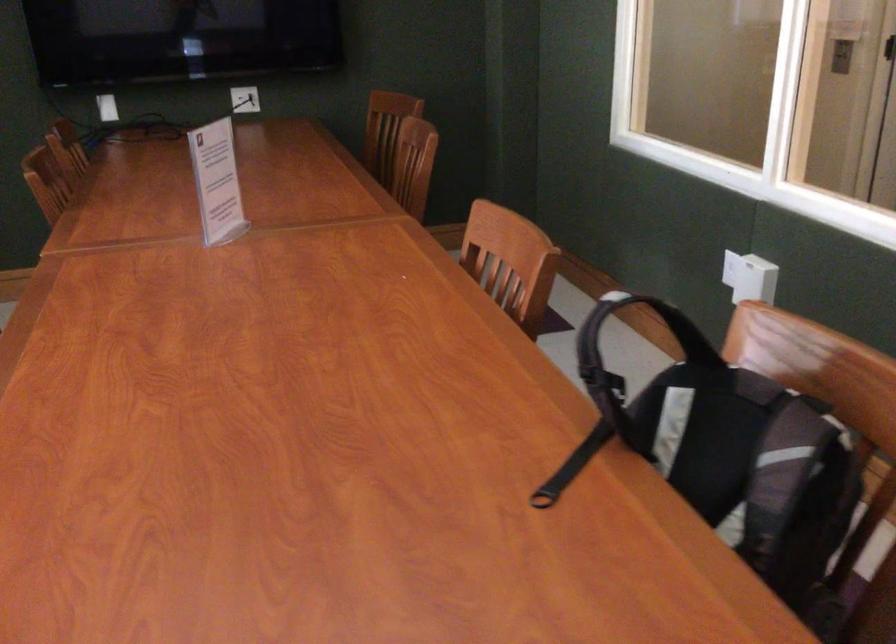
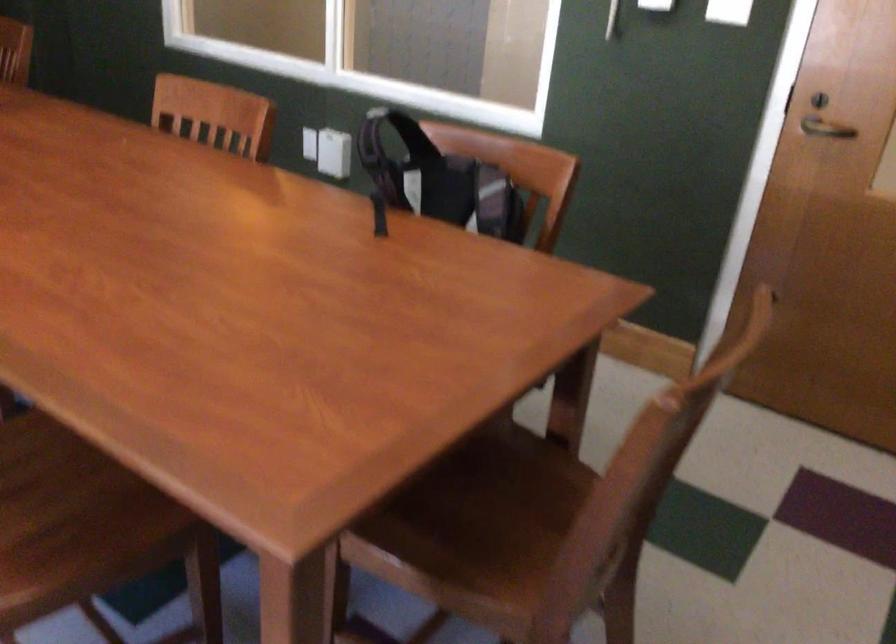
In the second image, find the point that corresponds to [746,289] in the first image.

(333, 153)